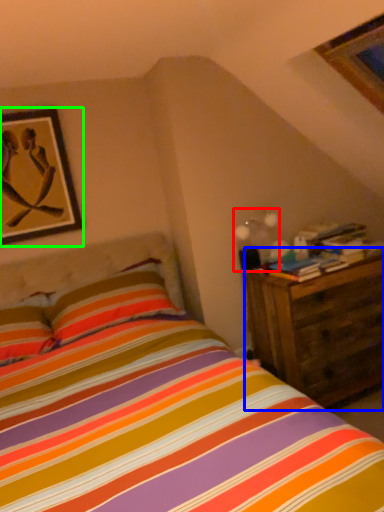
Question: Which object is positioned farthest from light fixture (highlighted by a red box)? Select from nightstand (highlighted by a blue box) and picture frame (highlighted by a green box).

Choices:
 (A) nightstand
 (B) picture frame

Answer: (B)